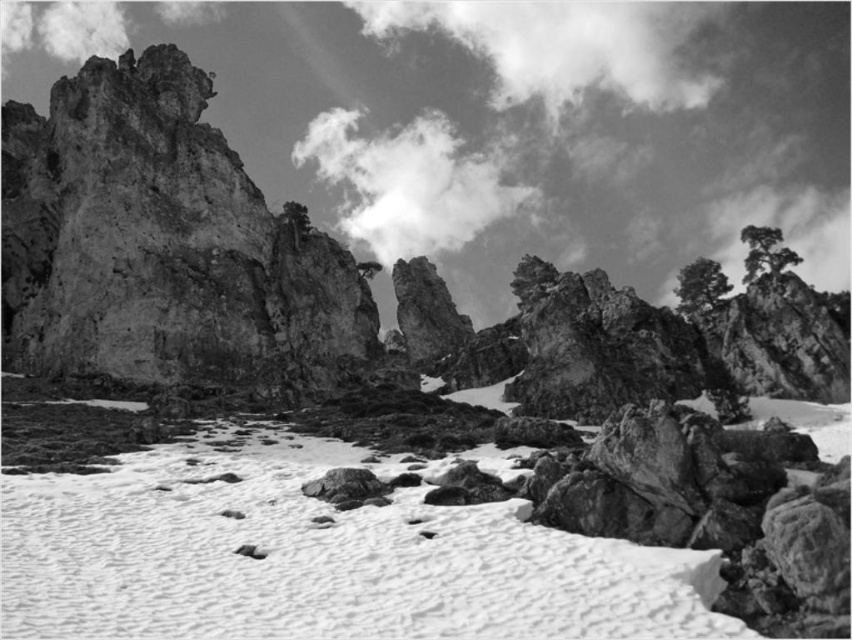
Between point (648, 56) and point (487, 168), which one is positioned behind?

The point (648, 56) is more distant.

Can you confirm if fuzzy white cloud at upper center is bigger than cloudy sky at upper center?

Yes.

Does point (596, 54) come behind point (485, 224)?

Yes.

The height and width of the screenshot is (640, 852). Find the location of `fuzzy white cloud at upper center`. fuzzy white cloud at upper center is located at coordinates (565, 45).

Is white textured snow at center positioned behind fuzzy white cloud at upper center?

No, it is not.

Is white textured snow at center bigger than fuzzy white cloud at upper center?

Incorrect, white textured snow at center is not larger than fuzzy white cloud at upper center.

Is point (56, 586) closer to viewer compared to point (574, 93)?

Yes, point (56, 586) is in front of point (574, 93).

Identify the location of white textured snow at center. (318, 557).

Who is higher up, white textured snow at center or cloudy sky at upper center?

Positioned higher is cloudy sky at upper center.

Which is more to the left, white textured snow at center or cloudy sky at upper center?

From the viewer's perspective, cloudy sky at upper center appears more on the left side.

Which is in front, point (275, 435) or point (350, 140)?

Point (275, 435) is more forward.

Where is `white textured snow at center`? The height and width of the screenshot is (640, 852). white textured snow at center is located at coordinates (318, 557).